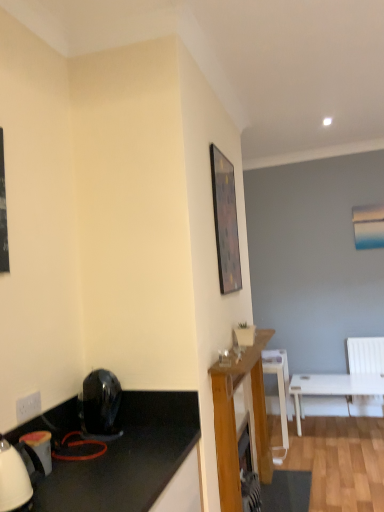
Question: Is white glossy kettle at lower left, arranged as the 1th appliance when viewed from the front, closer to camera compared to wooden mantelpiece at center?

Choices:
 (A) yes
 (B) no

Answer: (A)

Question: Is white glossy kettle at lower left, marked as the 2th appliance in a back-to-front arrangement, to the right of wooden mantelpiece at center from the viewer's perspective?

Choices:
 (A) no
 (B) yes

Answer: (A)

Question: Does white glossy kettle at lower left, which appears as the 2th appliance when viewed from the right, have a smaller size compared to wooden mantelpiece at center?

Choices:
 (A) no
 (B) yes

Answer: (B)

Question: Would you say white glossy kettle at lower left, which appears as the 2th appliance when viewed from the right, is outside wooden mantelpiece at center?

Choices:
 (A) no
 (B) yes

Answer: (B)

Question: From a real-world perspective, is white glossy kettle at lower left, marked as the 2th appliance in a back-to-front arrangement, below wooden mantelpiece at center?

Choices:
 (A) no
 (B) yes

Answer: (A)

Question: Considering the relative sizes of white glossy kettle at lower left, which is counted as the 1th appliance, starting from the left, and wooden mantelpiece at center in the image provided, is white glossy kettle at lower left, which is counted as the 1th appliance, starting from the left, wider than wooden mantelpiece at center?

Choices:
 (A) yes
 (B) no

Answer: (B)

Question: Is wooden framed picture at upper center further to camera compared to black glossy hairdryer at lower left, the 2th appliance when ordered from left to right?

Choices:
 (A) yes
 (B) no

Answer: (A)

Question: Are wooden framed picture at upper center and black glossy hairdryer at lower left, which ranks as the first appliance in back-to-front order, far apart?

Choices:
 (A) no
 (B) yes

Answer: (B)

Question: From a real-world perspective, is wooden framed picture at upper center on black glossy hairdryer at lower left, the 2th appliance when ordered from left to right?

Choices:
 (A) no
 (B) yes

Answer: (B)

Question: From the image's perspective, is wooden framed picture at upper center over black glossy hairdryer at lower left, which ranks as the first appliance in back-to-front order?

Choices:
 (A) yes
 (B) no

Answer: (A)

Question: Is black glossy hairdryer at lower left, which is the first appliance in right-to-left order, completely or partially inside wooden framed picture at upper center?

Choices:
 (A) yes
 (B) no

Answer: (B)

Question: Does wooden framed picture at upper center have a greater height compared to black glossy hairdryer at lower left, the second appliance from the front?

Choices:
 (A) yes
 (B) no

Answer: (A)

Question: Is wooden framed picture at upper center aimed at transparent glass coffee cup at center?

Choices:
 (A) no
 (B) yes

Answer: (A)